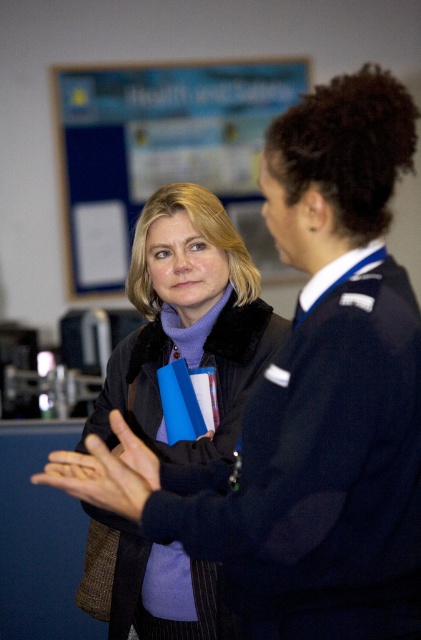
Question: Based on their relative distances, which object is farther from the blue paperboard at upper center?

Choices:
 (A) matte black hand at center
 (B) matte black jacket at center

Answer: (A)

Question: Which point is closer to the camera taking this photo?

Choices:
 (A) (96, 548)
 (B) (90, 224)
 (C) (98, 454)

Answer: (C)

Question: Does blue paperboard at upper center appear under matte black hand at center?

Choices:
 (A) yes
 (B) no

Answer: (B)

Question: Is matte black jacket at center in front of matte black hand at center?

Choices:
 (A) yes
 (B) no

Answer: (B)

Question: Estimate the real-world distances between objects in this image. Which object is farther from the blue paperboard at upper center?

Choices:
 (A) matte black jacket at center
 (B) matte black hand at center

Answer: (B)

Question: Does matte black jacket at center come in front of matte black hand at center?

Choices:
 (A) no
 (B) yes

Answer: (A)